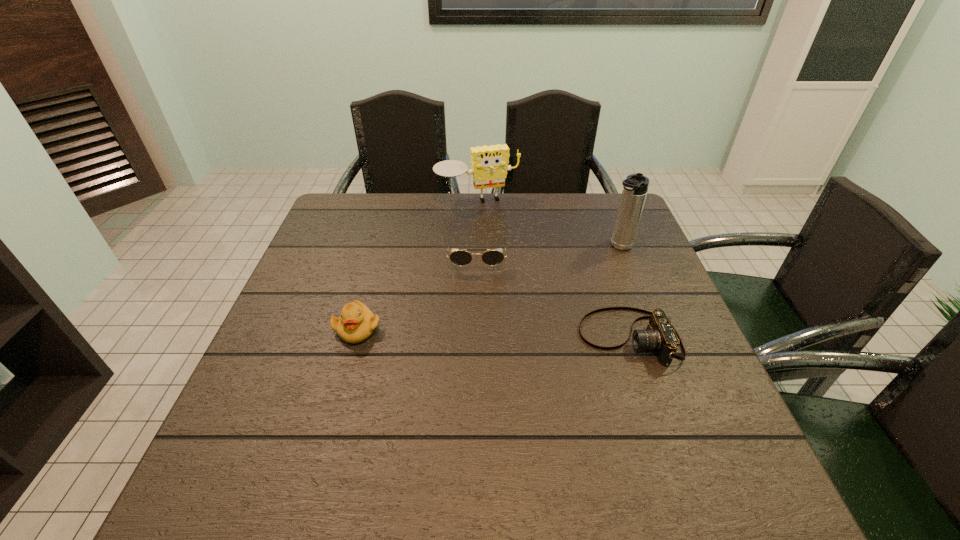
Find the location of a particular element. The image size is (960, 540). free space between the farthest object and the duckling is located at coordinates (418, 266).

Identify the location of free point between the tallest object and the sunglasses. (548, 252).

Where is `free spot between the fourth shortest object and the duckling`? The image size is (960, 540). free spot between the fourth shortest object and the duckling is located at coordinates (418, 266).

The width and height of the screenshot is (960, 540). I want to click on free spot between the fourth shortest object and the camera, so click(553, 270).

Identify the location of free space between the camera and the sunglasses. This screenshot has width=960, height=540. (553, 297).

The height and width of the screenshot is (540, 960). Identify the location of free point between the duckling and the sunglasses. (417, 293).

Where is `vacant area between the duckling and the sunglasses`? The width and height of the screenshot is (960, 540). vacant area between the duckling and the sunglasses is located at coordinates (417, 293).

The height and width of the screenshot is (540, 960). Find the location of `unoccupied position between the sunglasses and the duckling`. unoccupied position between the sunglasses and the duckling is located at coordinates (417, 293).

Locate which object ranks fourth in proximity to the camera. Please provide its 2D coordinates. Your answer should be formatted as a tuple, i.e. [(x, y)], where the tuple contains the x and y coordinates of a point satisfying the conditions above.

[(356, 323)]

Find the location of a particular element. This screenshot has width=960, height=540. object that stands as the third closest to the sponge is located at coordinates (660, 335).